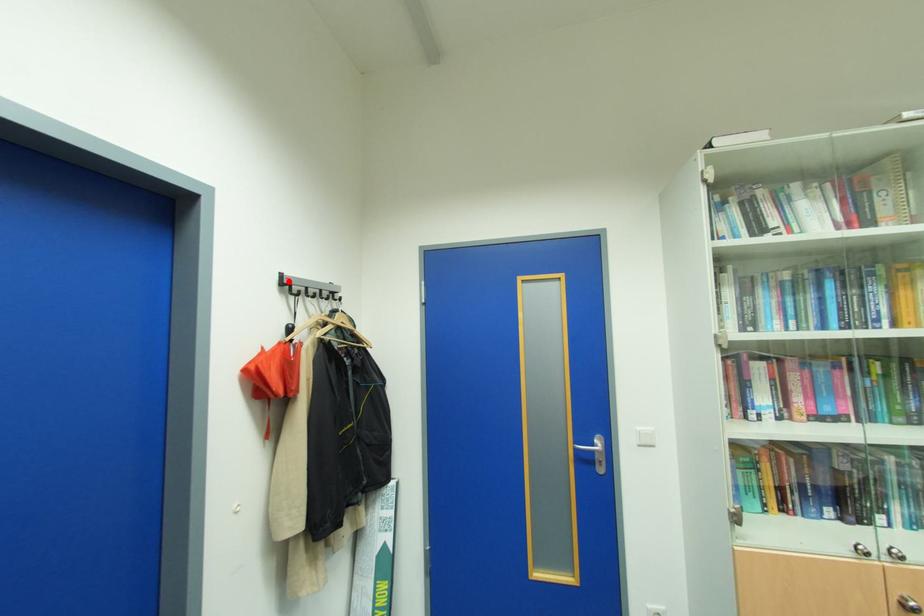
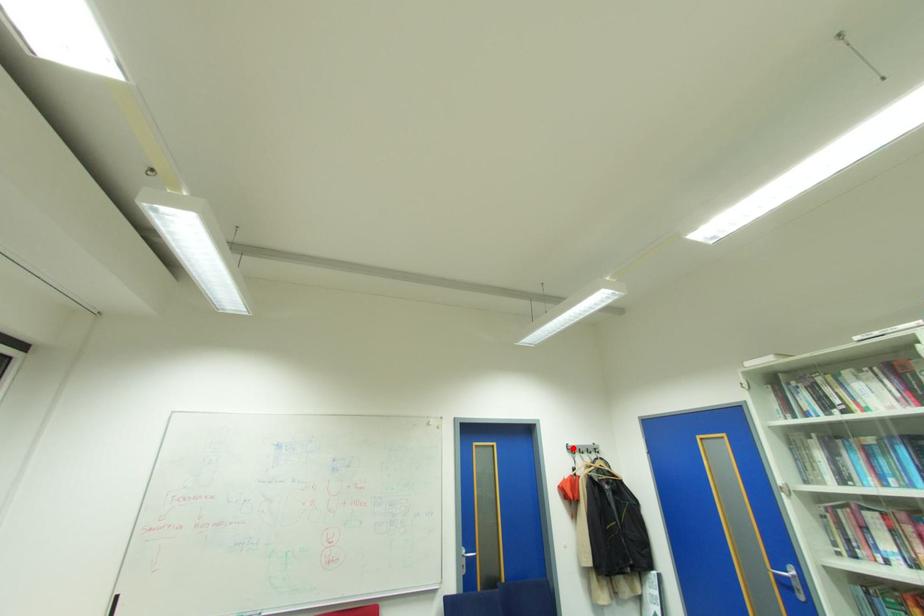
I am providing you with two images of the same scene from different viewpoints. A red point is marked on the first image and another point is marked on the second image. Does the point marked in image1 correspond to the same location as the one in image2?

Yes